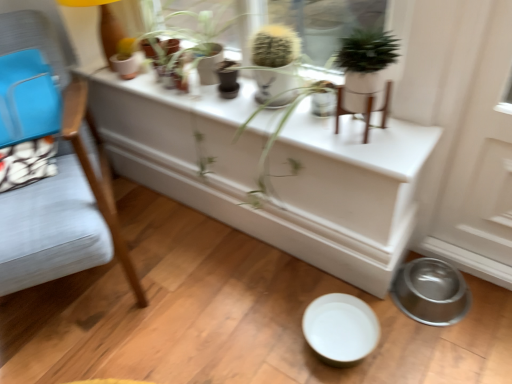
Find the location of a particular element. vacant area located to the right-hand side of metallic silver bowl at lower right is located at coordinates (490, 301).